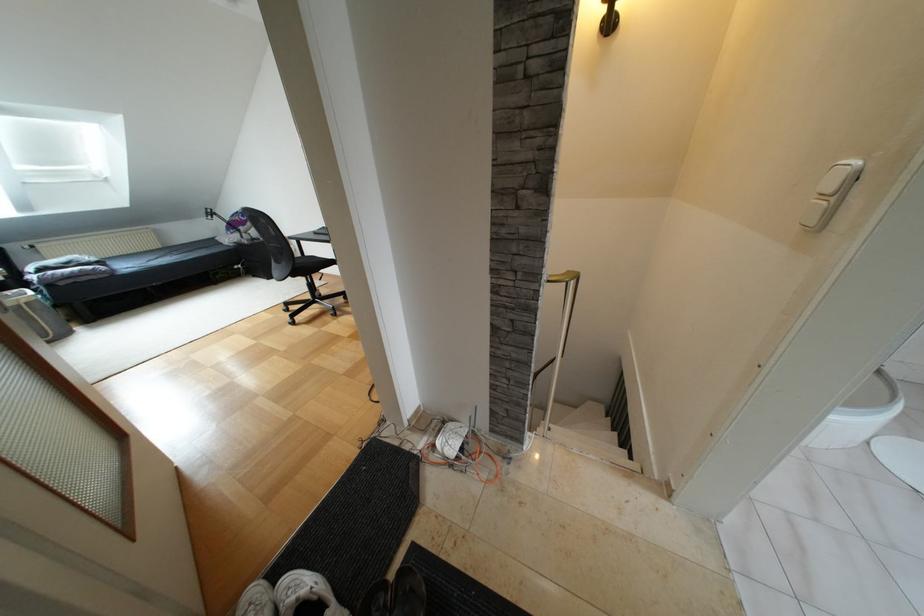
What do you see at coordinates (609, 18) in the screenshot? This screenshot has width=924, height=616. I see `a desk lamp head` at bounding box center [609, 18].